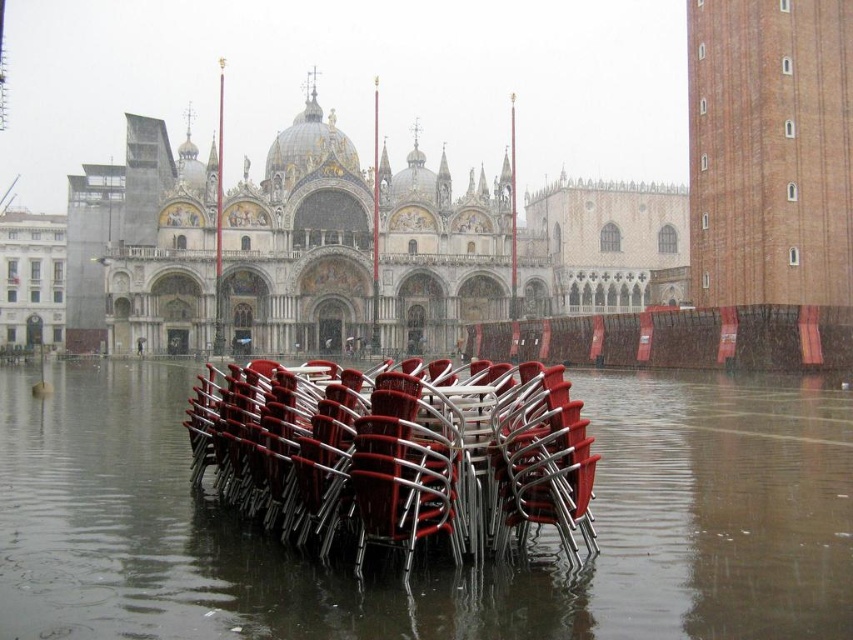
Find the location of a particular element. This screenshot has width=853, height=640. red plastic chairs at center is located at coordinates (433, 570).

Is the position of red plastic chairs at center more distant than that of metallic red chairs at lower center?

No.

Identify the location of red plastic chairs at center. Image resolution: width=853 pixels, height=640 pixels. (433, 570).

What are the coordinates of `red plastic chairs at center` in the screenshot? It's located at (433, 570).